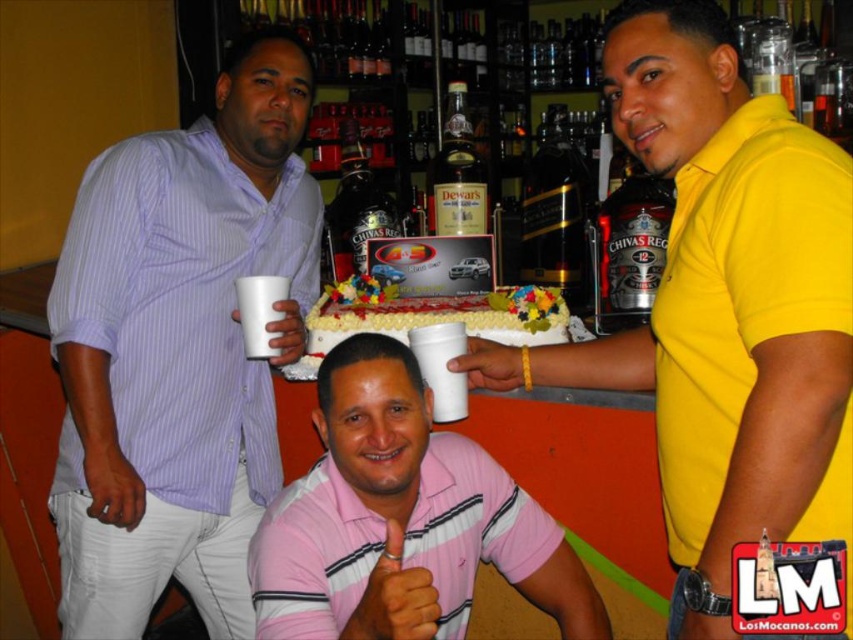
Question: Does purple striped shirt at upper left have a larger size compared to translucent glass dewar's at center?

Choices:
 (A) yes
 (B) no

Answer: (A)

Question: Which of the following is the closest to the observer?

Choices:
 (A) (544, 150)
 (B) (437, 371)
 (C) (140, 371)

Answer: (B)

Question: Is the position of yellow matte shirt at center less distant than that of white paper cup at center?

Choices:
 (A) no
 (B) yes

Answer: (B)

Question: Which point is closer to the camera?

Choices:
 (A) pink striped polo shirt at center
 (B) white paper cup at center
 (C) white styrofoam cup at lower center
 (D) translucent glass dewar's at center

Answer: (A)

Question: Which point is closer to the camera?

Choices:
 (A) translucent glass dewar's at center
 (B) white frosted cake at center
 (C) white styrofoam cup at lower center
 (D) purple striped shirt at upper left

Answer: (D)

Question: Can you confirm if yellow matte shirt at center is positioned to the left of translucent glass dewar's at center?

Choices:
 (A) no
 (B) yes

Answer: (A)